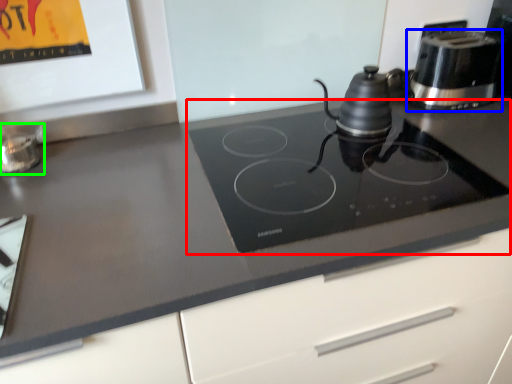
Question: Considering the real-world distances, which object is farthest from gas stove (highlighted by a red box)? kitchen appliance (highlighted by a blue box) or appliance (highlighted by a green box)?

Choices:
 (A) kitchen appliance
 (B) appliance

Answer: (B)